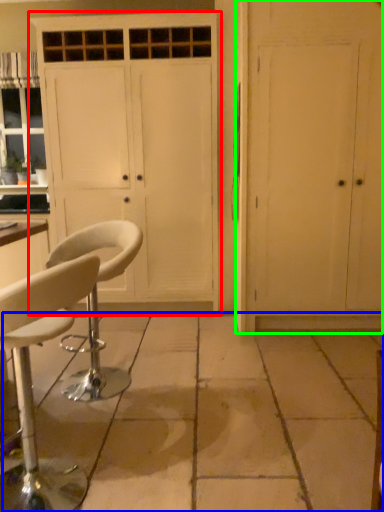
Question: Which is farther away from cabinetry (highlighted by a red box)? concrete (highlighted by a blue box) or door (highlighted by a green box)?

Choices:
 (A) concrete
 (B) door

Answer: (A)